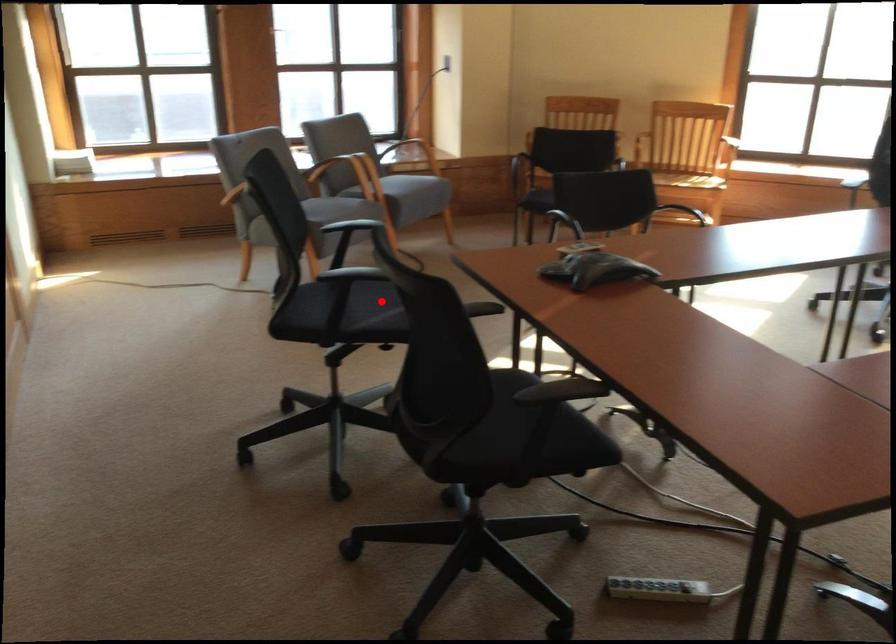
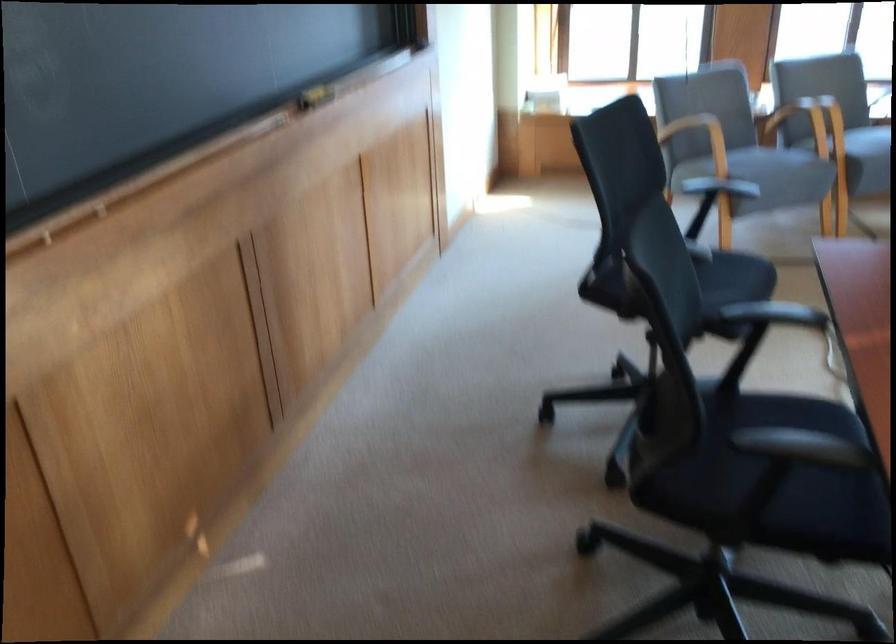
Question: I am providing you with two images of the same scene from different viewpoints. Image1 has a red point marked. In image2, the corresponding 3D location appears at what relative position? Reply with the corresponding letter.

Choices:
 (A) Closer
 (B) Farther

Answer: (A)